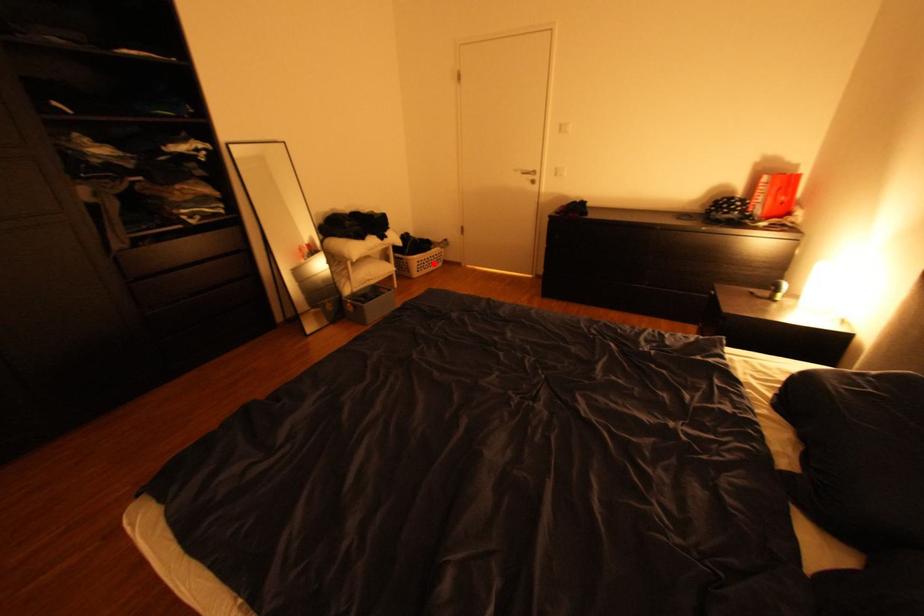
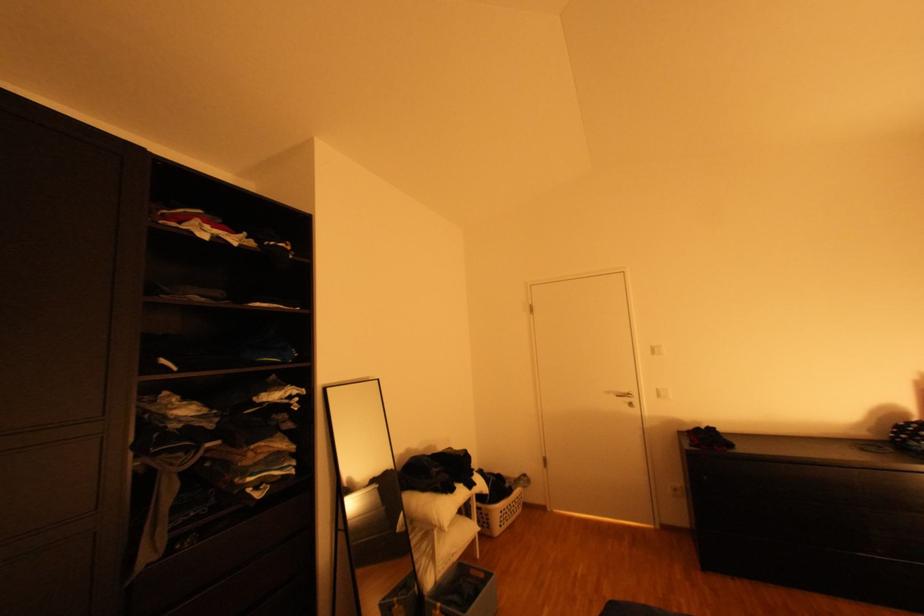
The point at the highlighted location is marked in the first image. Where is the corresponding point in the second image?

(516, 513)